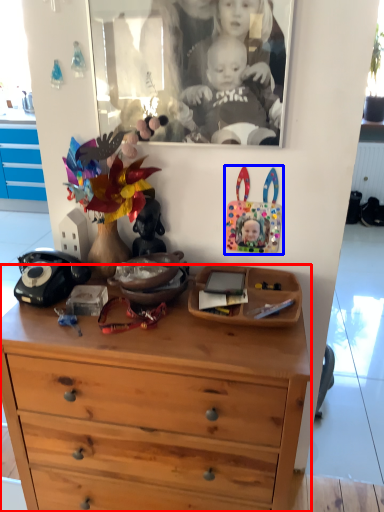
Question: Which point is further to the camera, chest of drawers (highlighted by a red box) or toy (highlighted by a blue box)?

Choices:
 (A) chest of drawers
 (B) toy

Answer: (B)